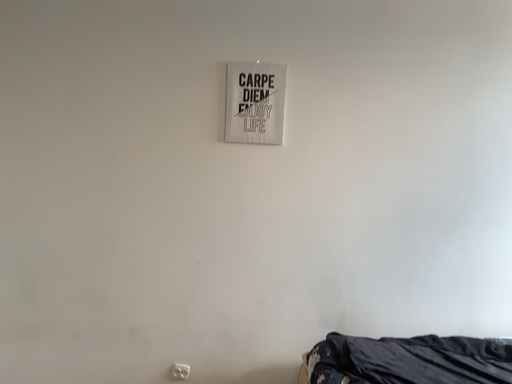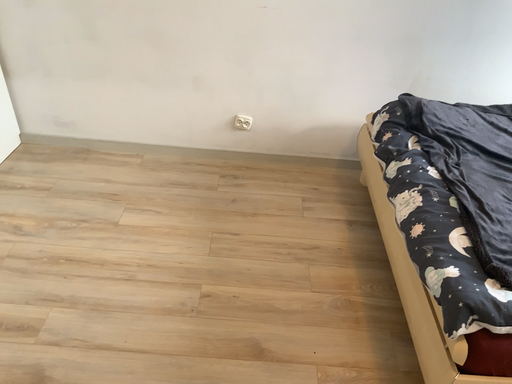
Question: Which way did the camera rotate in the video?

Choices:
 (A) rotated right
 (B) rotated left

Answer: (B)